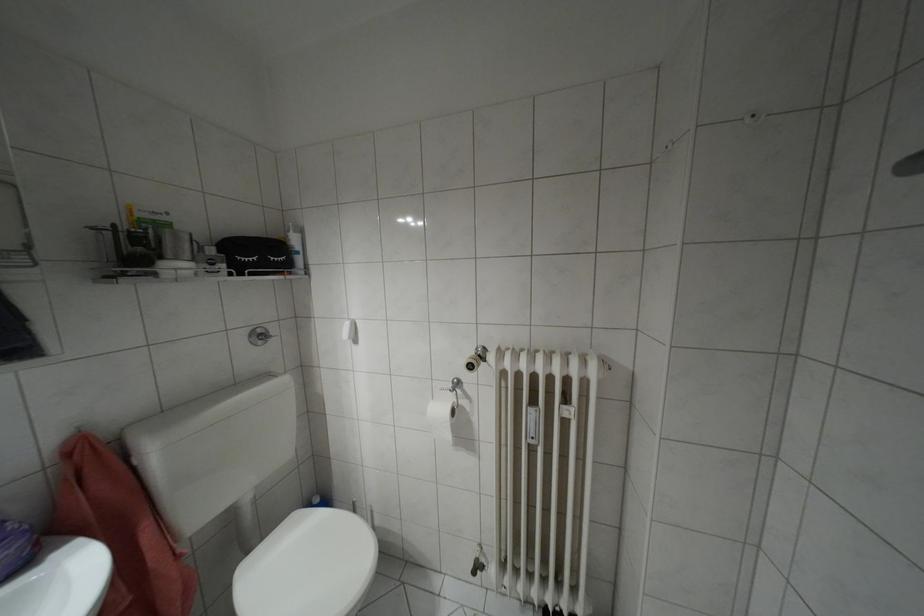
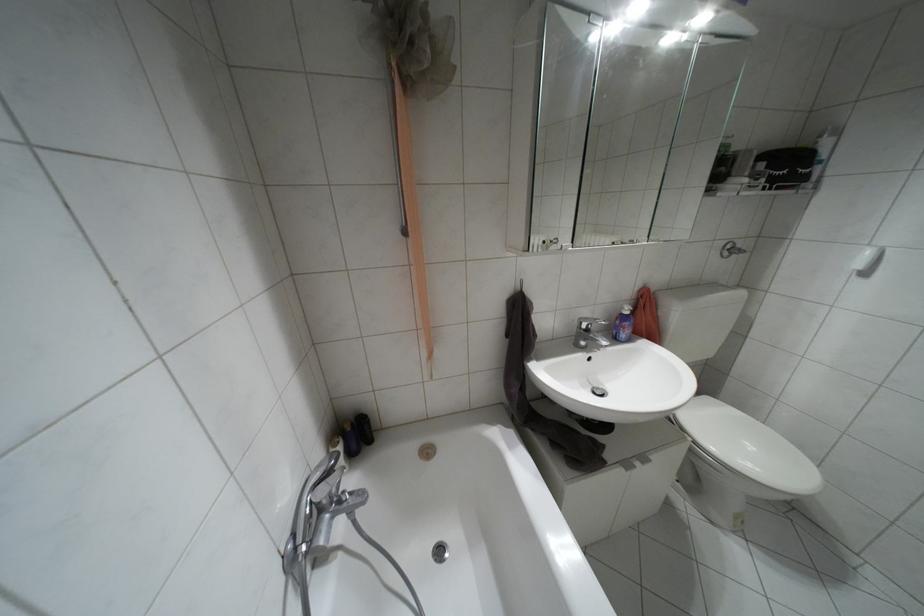
Find the pixel in the second image that matches point (260, 341) in the first image.

(723, 254)